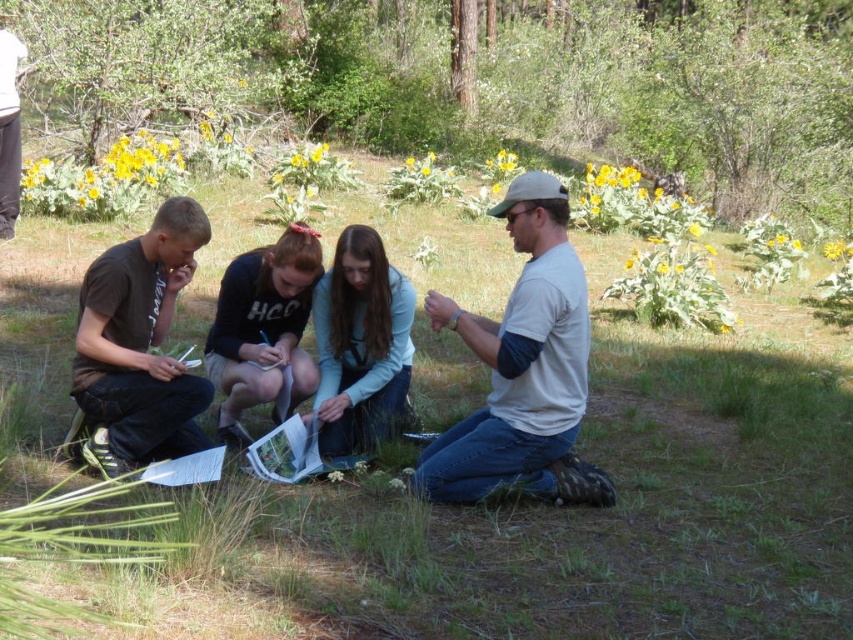
Question: Which of the following is the farthest from the observer?

Choices:
 (A) brown cotton shirt at left
 (B) light blue fabric at center
 (C) green leafy tree at center
 (D) dark blue jeans at center

Answer: (C)

Question: Is light blue fabric at center further to camera compared to brushed metal water at bottle left?

Choices:
 (A) yes
 (B) no

Answer: (B)

Question: Is light blue fabric at center to the right of dark blue jeans at center from the viewer's perspective?

Choices:
 (A) yes
 (B) no

Answer: (A)

Question: Which of the following is the farthest from the observer?

Choices:
 (A) (277, 289)
 (B) (183, 278)

Answer: (A)

Question: Which of these objects is positioned closest to the dark blue jeans at center?

Choices:
 (A) light blue fabric at center
 (B) white cotton shirt at center
 (C) green leafy tree at center

Answer: (A)

Question: Can you confirm if light blue fabric at center is wider than brushed metal water at bottle left?

Choices:
 (A) no
 (B) yes

Answer: (B)